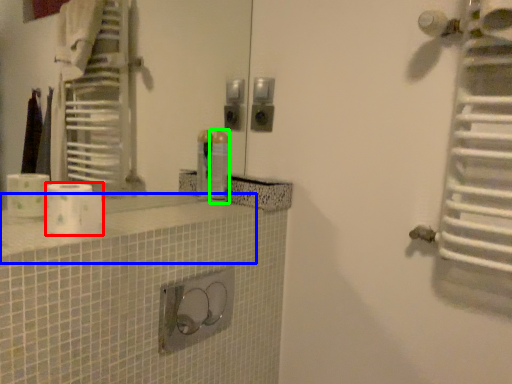
Question: Which object is positioned farthest from toilet paper (highlighted by a red box)? Select from counter top (highlighted by a blue box) and toiletry (highlighted by a green box).

Choices:
 (A) counter top
 (B) toiletry

Answer: (B)